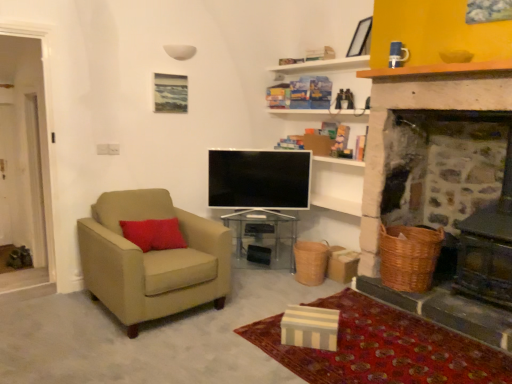
Image resolution: width=512 pixels, height=384 pixels. What do you see at coordinates (152, 259) in the screenshot? I see `beige fabric armchair at left` at bounding box center [152, 259].

What do you see at coordinates (408, 257) in the screenshot?
I see `woven brown basket at right, which appears as the first basket when viewed from the right` at bounding box center [408, 257].

Where is `transparent acrylic table at center`? The height and width of the screenshot is (384, 512). transparent acrylic table at center is located at coordinates (262, 239).

You are a GUI agent. You are given a task and a screenshot of the screen. Output one action in this format:
    pyautogui.click(x=<x>, y=<y>)
    Task: Click on the braided wicker basket at lower center, which is the 1th basket in left-to-right order
    
    Given the screenshot: What is the action you would take?
    pyautogui.click(x=311, y=262)

Where is `beige fabric armchair at left`? The width and height of the screenshot is (512, 384). beige fabric armchair at left is located at coordinates (152, 259).

Which is more to the right, transparent acrylic table at center or braided wicker basket at lower center, which is the second basket in right-to-left order?

Positioned to the right is braided wicker basket at lower center, which is the second basket in right-to-left order.

From the image's perspective, would you say transparent acrylic table at center is positioned over braided wicker basket at lower center, which is the second basket in right-to-left order?

Yes, from the image's perspective, transparent acrylic table at center is above braided wicker basket at lower center, which is the second basket in right-to-left order.

How many degrees apart are the facing directions of transparent acrylic table at center and braided wicker basket at lower center, which is the 1th basket in left-to-right order?

The angular difference between transparent acrylic table at center and braided wicker basket at lower center, which is the 1th basket in left-to-right order, is 60.8 degrees.

Based on the photo, which is in front, transparent acrylic table at center or braided wicker basket at lower center, which is the 1th basket in left-to-right order?

braided wicker basket at lower center, which is the 1th basket in left-to-right order, is more forward.

Between point (319, 264) and point (426, 361), which one is positioned behind?

The point (319, 264) is farther.

From the image's perspective, is braided wicker basket at lower center, which is the 1th basket in left-to-right order, located above or below striped fabric box at lower center?

braided wicker basket at lower center, which is the 1th basket in left-to-right order, is situated higher than striped fabric box at lower center in the image.

Considering the positions of objects braided wicker basket at lower center, the 2th basket positioned from the front, and striped fabric box at lower center in the image provided, who is more to the right, braided wicker basket at lower center, the 2th basket positioned from the front, or striped fabric box at lower center?

striped fabric box at lower center.

Considering the sizes of braided wicker basket at lower center, the 2th basket positioned from the front, and striped fabric box at lower center in the image, is braided wicker basket at lower center, the 2th basket positioned from the front, taller or shorter than striped fabric box at lower center?

In the image, braided wicker basket at lower center, the 2th basket positioned from the front, appears to be taller than striped fabric box at lower center.

Find the location of `table beneath the matte black picture frame at upper center (from a real-world perspective)`. table beneath the matte black picture frame at upper center (from a real-world perspective) is located at coordinates (262, 239).

Looking at this image, can you confirm if transparent acrylic table at center is wider than matte black picture frame at upper center?

Indeed, transparent acrylic table at center has a greater width compared to matte black picture frame at upper center.

Can you tell me how much transparent acrylic table at center and matte black picture frame at upper center differ in facing direction?

The angular difference between transparent acrylic table at center and matte black picture frame at upper center is 80.8 degrees.

Is point (294, 266) closer or farther from the camera than point (364, 23)?

Point (294, 266) appears to be farther away from the viewer than point (364, 23).

Is striped fabric box at lower center taller or shorter than braided wicker basket at lower center, which is the 1th basket in left-to-right order?

striped fabric box at lower center is shorter than braided wicker basket at lower center, which is the 1th basket in left-to-right order.

Between striped fabric box at lower center and braided wicker basket at lower center, the 1th basket when ordered from back to front, which one has smaller size?

braided wicker basket at lower center, the 1th basket when ordered from back to front, is smaller.

Between striped fabric box at lower center and braided wicker basket at lower center, which is the second basket in right-to-left order, which one is positioned in front?

striped fabric box at lower center is more forward.

Does point (280, 341) appear closer or farther from the camera than point (319, 279)?

Point (280, 341).

How many degrees apart are the facing directions of transparent acrylic table at center and flat screen tv at center?

They differ by 2.68 degrees in their facing directions.

Is transparent acrylic table at center closer to the viewer compared to flat screen tv at center?

No.

How far apart are transparent acrylic table at center and flat screen tv at center?

transparent acrylic table at center is 42.83 centimeters from flat screen tv at center.

Is transparent acrylic table at center oriented away from flat screen tv at center?

No, flat screen tv at center is not at the back of transparent acrylic table at center.

Considering the sizes of beige fabric armchair at left and flat screen tv at center in the image, is beige fabric armchair at left bigger or smaller than flat screen tv at center?

Considering their sizes, beige fabric armchair at left takes up more space than flat screen tv at center.

Is beige fabric armchair at left taller or shorter than flat screen tv at center?

beige fabric armchair at left is taller than flat screen tv at center.

Where is `chair on the left side of flat screen tv at center`? chair on the left side of flat screen tv at center is located at coordinates (152, 259).

Consider the image. Is beige fabric armchair at left aimed at flat screen tv at center?

No.

Is flat screen tv at center positioned with its back to matte black picture frame at upper center?

No, matte black picture frame at upper center is not at the back of flat screen tv at center.

Considering the relative sizes of flat screen tv at center and matte black picture frame at upper center in the image provided, is flat screen tv at center bigger than matte black picture frame at upper center?

Yes, flat screen tv at center is bigger than matte black picture frame at upper center.

Measure the distance from flat screen tv at center to matte black picture frame at upper center.

They are 4.17 feet apart.

From a real-world perspective, is flat screen tv at center over matte black picture frame at upper center?

No, from a real-world perspective, flat screen tv at center is not over matte black picture frame at upper center

Find the location of a particular element. This screenshot has height=384, width=512. table above the braided wicker basket at lower center, which is the second basket in right-to-left order (from the image's perspective) is located at coordinates (262, 239).

This screenshot has width=512, height=384. I want to click on plain located on the right of braided wicker basket at lower center, which is the 1th basket in left-to-right order, so pos(382,348).

Considering their positions, is transparent acrylic table at center positioned further to matte black picture frame at upper center than braided wicker basket at lower center, the 1th basket when ordered from back to front?

transparent acrylic table at center.

From the image, which object appears to be farther from beige fabric armchair at left, braided wicker basket at lower center, the 1th basket when ordered from back to front, or matte black picture frame at upper center?

Among the two, matte black picture frame at upper center is located further to beige fabric armchair at left.

Which object lies nearer to the anchor point woven brown basket at right, which is the 2th basket in left-to-right order, matte black picture frame at upper center or beige fabric armchair at left?

Among the two, beige fabric armchair at left is located nearer to woven brown basket at right, which is the 2th basket in left-to-right order.

Estimate the real-world distances between objects in this image. Which object is closer to flat screen tv at center, beige fabric armchair at left or transparent acrylic table at center?

transparent acrylic table at center is closer to flat screen tv at center.

Looking at the image, which one is located closer to transparent acrylic table at center, matte black picture frame at upper center or woven brown basket at right, which is counted as the first basket, starting from the front?

Based on the image, woven brown basket at right, which is counted as the first basket, starting from the front, appears to be nearer to transparent acrylic table at center.

Considering their positions, is braided wicker basket at lower center, the 2th basket positioned from the front, positioned closer to beige fabric armchair at left than woven brown basket at right, which appears as the first basket when viewed from the right?

The object closer to beige fabric armchair at left is braided wicker basket at lower center, the 2th basket positioned from the front.

Consider the image. When comparing their distances from matte black picture frame at upper center, does braided wicker basket at lower center, the 1th basket when ordered from back to front, or woven brown basket at right, which is counted as the first basket, starting from the front, seem closer?

The object closer to matte black picture frame at upper center is woven brown basket at right, which is counted as the first basket, starting from the front.

When comparing their distances from woven brown basket at right, the 2th basket when ordered from back to front, does beige fabric armchair at left or flat screen tv at center seem closer?

Based on the image, flat screen tv at center appears to be nearer to woven brown basket at right, the 2th basket when ordered from back to front.

At what (x,y) coordinates should I click in order to perform the action: click on table between matte black picture frame at upper center and striped fabric box at lower center in the up-down direction. Please return your answer as a coordinate pair (x, y). This screenshot has width=512, height=384. Looking at the image, I should click on (262, 239).

The width and height of the screenshot is (512, 384). I want to click on television between beige fabric armchair at left and woven brown basket at right, the 2th basket when ordered from back to front, in the horizontal direction, so click(259, 179).

Image resolution: width=512 pixels, height=384 pixels. In order to click on basket between striped fabric box at lower center and braided wicker basket at lower center, the 2th basket positioned from the front, from front to back in this screenshot , I will do `click(408, 257)`.

Where is `television between matte black picture frame at upper center and striped fabric box at lower center in the vertical direction`? television between matte black picture frame at upper center and striped fabric box at lower center in the vertical direction is located at coordinates (259, 179).